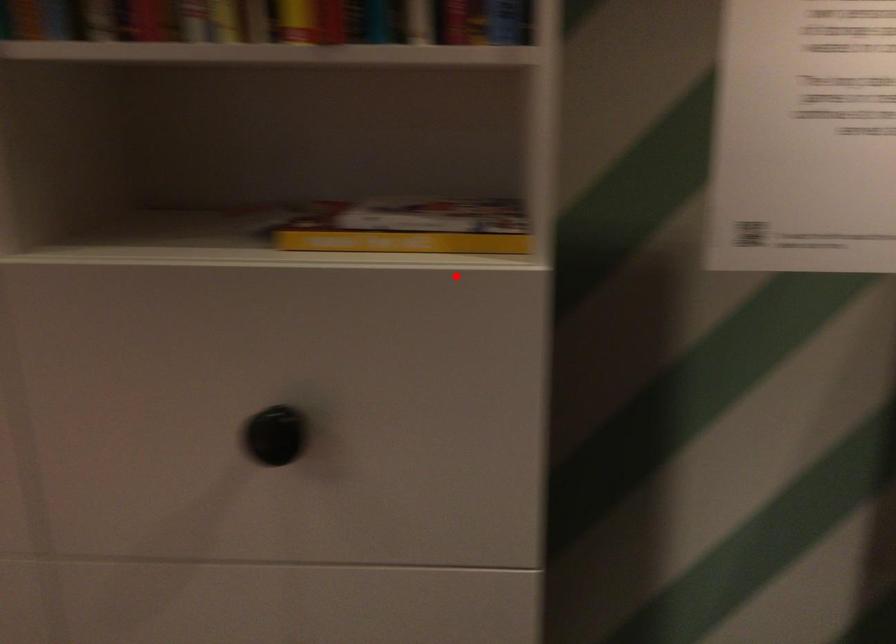
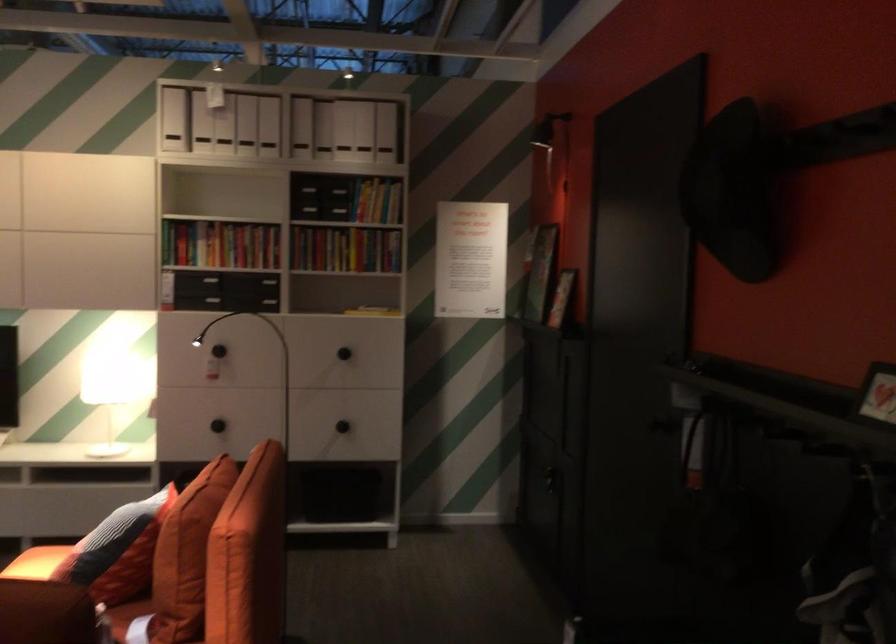
Question: I am providing you with two images of the same scene from different viewpoints. Image1 has a red point marked. In image2, the corresponding 3D location appears at what relative position? Reply with the corresponding letter.

Choices:
 (A) Closer
 (B) Farther

Answer: (B)